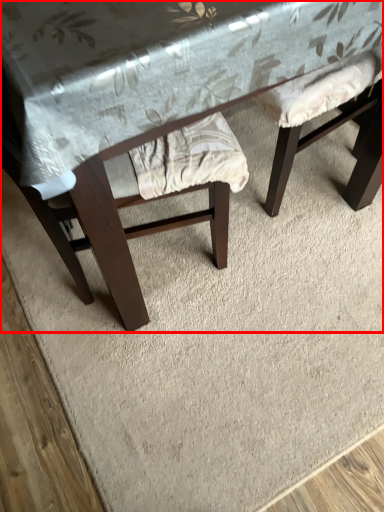
Question: From the image, what is the correct spatial relationship of table (annotated by the red box) in relation to swivel chair?

Choices:
 (A) right
 (B) left

Answer: (B)